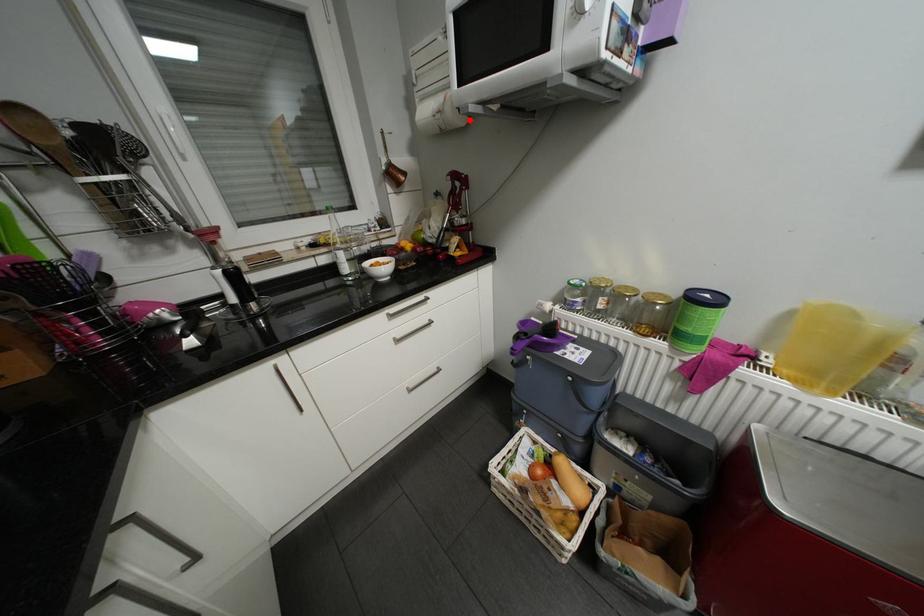
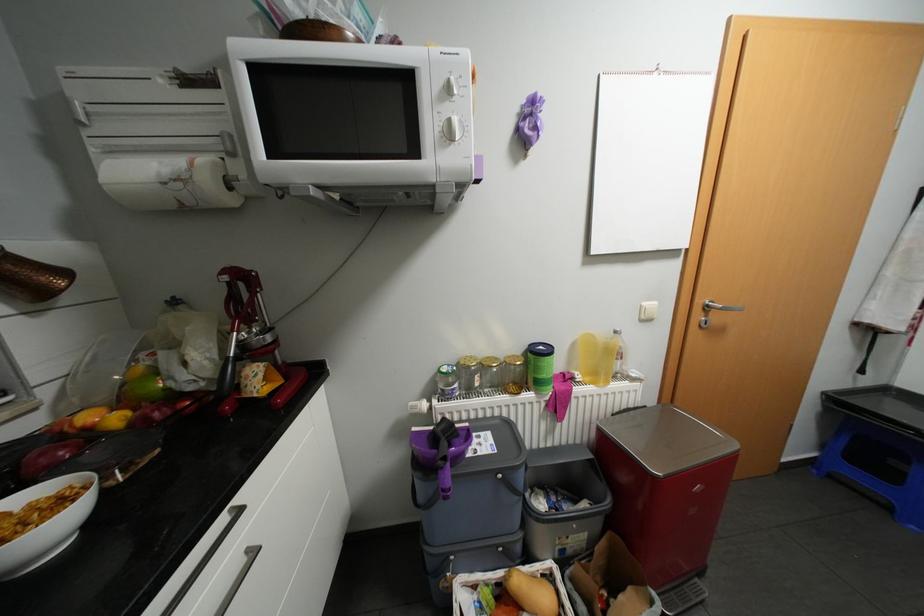
In the second image, find the point that corresponds to the highlighted location in the first image.

(239, 199)